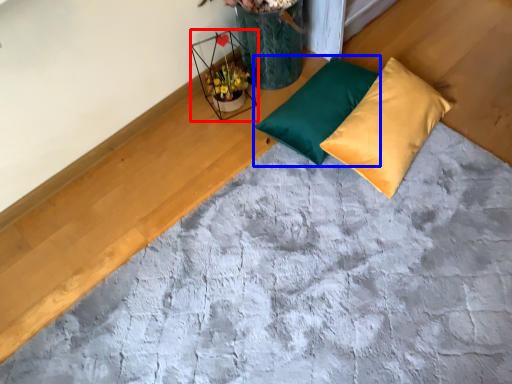
Question: Which point is closer to the camera, flower basket (highlighted by a red box) or pillow (highlighted by a blue box)?

Choices:
 (A) flower basket
 (B) pillow

Answer: (B)